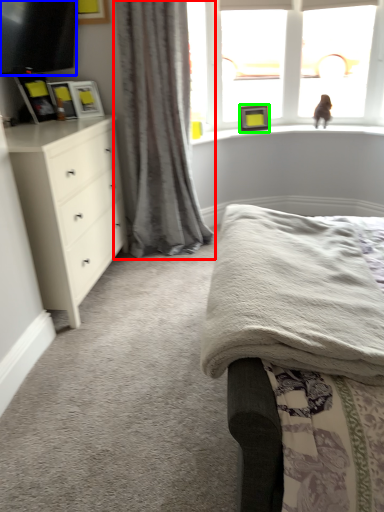
Question: Estimate the real-world distances between objects in this image. Which object is farther from curtain (highlighted by a red box), television (highlighted by a blue box) or picture frame (highlighted by a green box)?

Choices:
 (A) television
 (B) picture frame

Answer: (B)